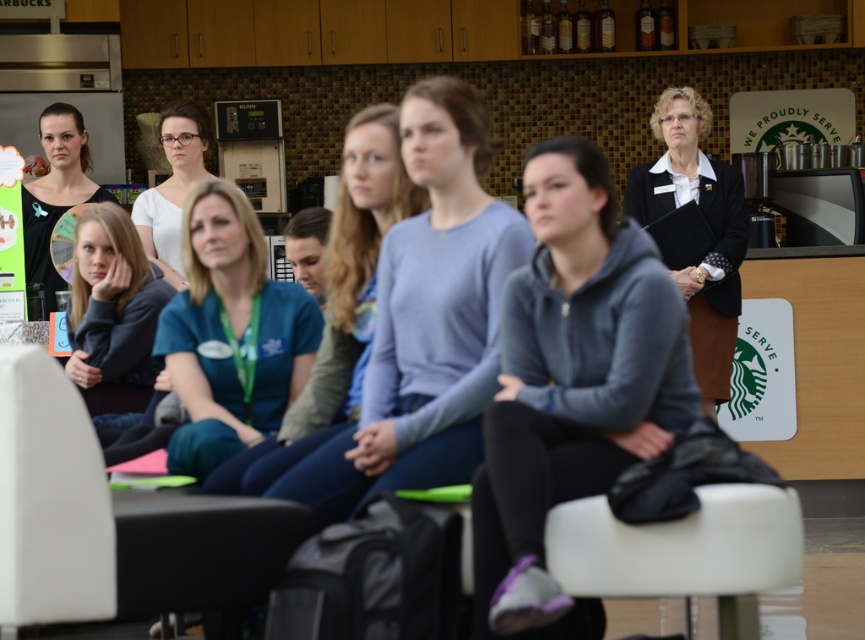
Can you confirm if light blue sweater at center is taller than matte black shirt at left?

Correct, light blue sweater at center is much taller as matte black shirt at left.

Find the location of a particular element. The height and width of the screenshot is (640, 865). light blue sweater at center is located at coordinates pyautogui.click(x=424, y=320).

At what (x,y) coordinates should I click in order to perform the action: click on light blue sweater at center. Please return your answer as a coordinate pair (x, y). This screenshot has width=865, height=640. Looking at the image, I should click on (424, 320).

Between gray fleece hoodie at center and matte black shirt at left, which one appears on the right side from the viewer's perspective?

gray fleece hoodie at center

Can you confirm if gray fleece hoodie at center is taller than matte black shirt at left?

Indeed, gray fleece hoodie at center has a greater height compared to matte black shirt at left.

Is point (537, 333) closer to camera compared to point (45, 202)?

Yes, it is in front of point (45, 202).

Locate an element on the screen. This screenshot has width=865, height=640. gray fleece hoodie at center is located at coordinates (569, 378).

Is black matte blazer at upper right thinner than matte gray hoodie at center?

Incorrect, black matte blazer at upper right's width is not less than matte gray hoodie at center's.

Is point (631, 177) less distant than point (103, 212)?

No, it is not.

What are the coordinates of `black matte blazer at upper right` in the screenshot? It's located at [708, 225].